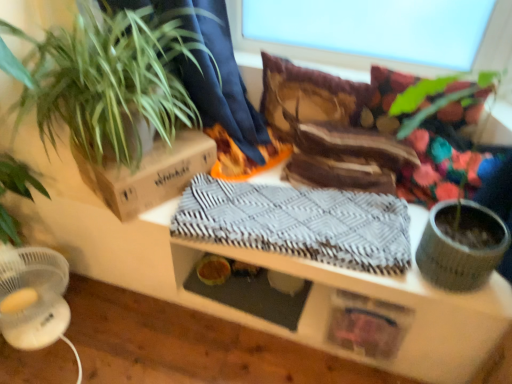
Question: Does transparent glass window screen at upper center have a larger size compared to brown cardboard box at upper left?

Choices:
 (A) no
 (B) yes

Answer: (B)

Question: Is transparent glass window screen at upper center positioned beyond the bounds of brown cardboard box at upper left?

Choices:
 (A) yes
 (B) no

Answer: (A)

Question: Is brown cardboard box at upper left a part of transparent glass window screen at upper center?

Choices:
 (A) yes
 (B) no

Answer: (B)

Question: Considering the relative sizes of transparent glass window screen at upper center and brown cardboard box at upper left in the image provided, is transparent glass window screen at upper center thinner than brown cardboard box at upper left?

Choices:
 (A) yes
 (B) no

Answer: (A)

Question: Does transparent glass window screen at upper center appear on the right side of brown cardboard box at upper left?

Choices:
 (A) no
 (B) yes

Answer: (B)

Question: From the image's perspective, is transparent glass window screen at upper center under brown cardboard box at upper left?

Choices:
 (A) no
 (B) yes

Answer: (A)

Question: Can you confirm if gray woven blanket at center is shorter than transparent glass window screen at upper center?

Choices:
 (A) no
 (B) yes

Answer: (B)

Question: Is gray woven blanket at center positioned beyond the bounds of transparent glass window screen at upper center?

Choices:
 (A) no
 (B) yes

Answer: (B)

Question: Can you confirm if gray woven blanket at center is thinner than transparent glass window screen at upper center?

Choices:
 (A) yes
 (B) no

Answer: (B)

Question: Can you confirm if gray woven blanket at center is positioned to the left of transparent glass window screen at upper center?

Choices:
 (A) no
 (B) yes

Answer: (B)

Question: Is gray woven blanket at center bigger than transparent glass window screen at upper center?

Choices:
 (A) no
 (B) yes

Answer: (A)

Question: Is gray woven blanket at center positioned in front of transparent glass window screen at upper center?

Choices:
 (A) no
 (B) yes

Answer: (B)

Question: Is gray woven blanket at center far away from textured wood table at center?

Choices:
 (A) no
 (B) yes

Answer: (A)